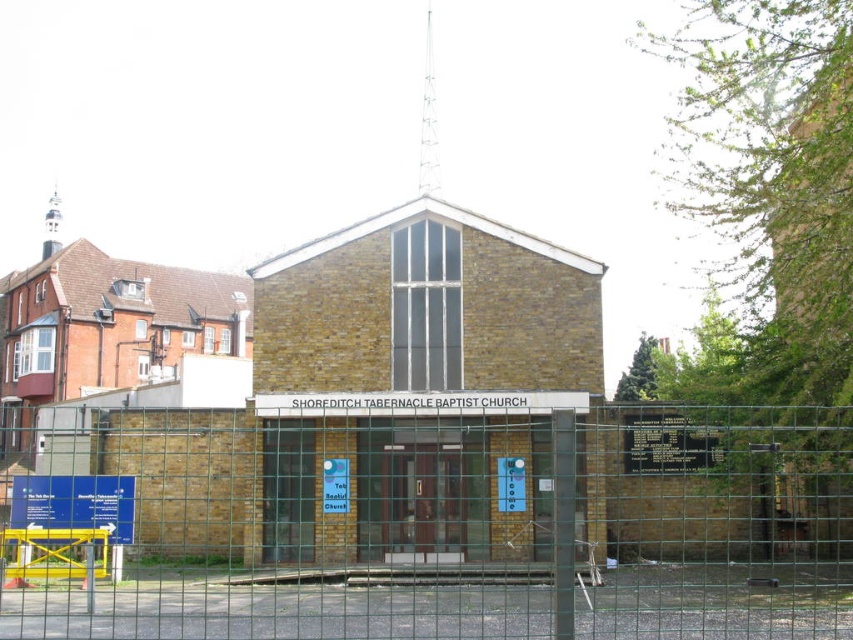
Question: Among these points, which one is nearest to the camera?

Choices:
 (A) (428, 554)
 (B) (335, 476)

Answer: (A)

Question: Which point is farther to the camera?

Choices:
 (A) [49, 515]
 (B) [233, 552]

Answer: (B)

Question: Does blue plastic sign at lower left come behind white paper sign at center?

Choices:
 (A) yes
 (B) no

Answer: (B)

Question: Does blue plastic sign at lower left appear under white paper sign at center?

Choices:
 (A) no
 (B) yes

Answer: (A)

Question: Based on their relative distances, which object is farther from the white paper sign at center?

Choices:
 (A) blue plastic sign at lower left
 (B) green wire mesh fence at center

Answer: (A)

Question: Can you confirm if green wire mesh fence at center is positioned to the left of blue plastic sign at lower left?

Choices:
 (A) yes
 (B) no

Answer: (B)